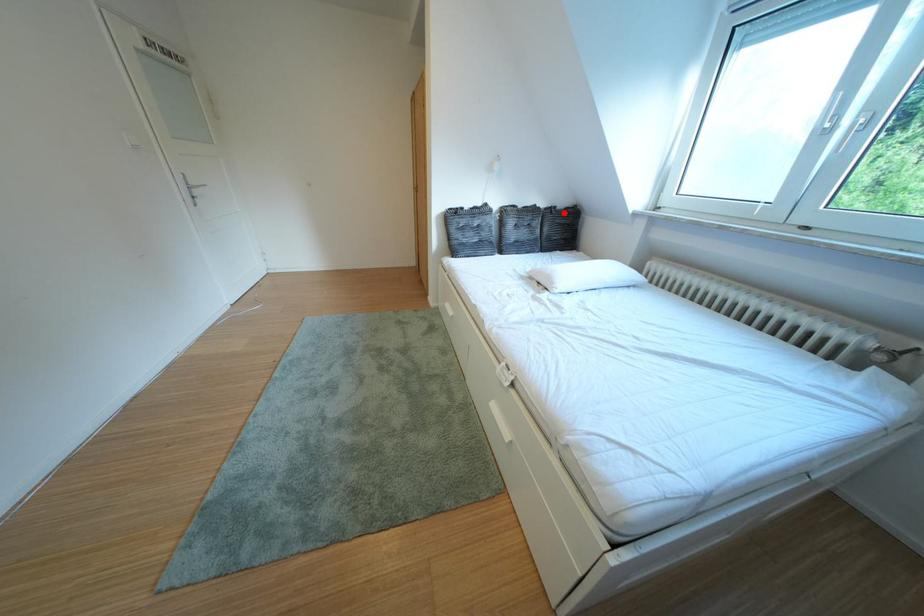
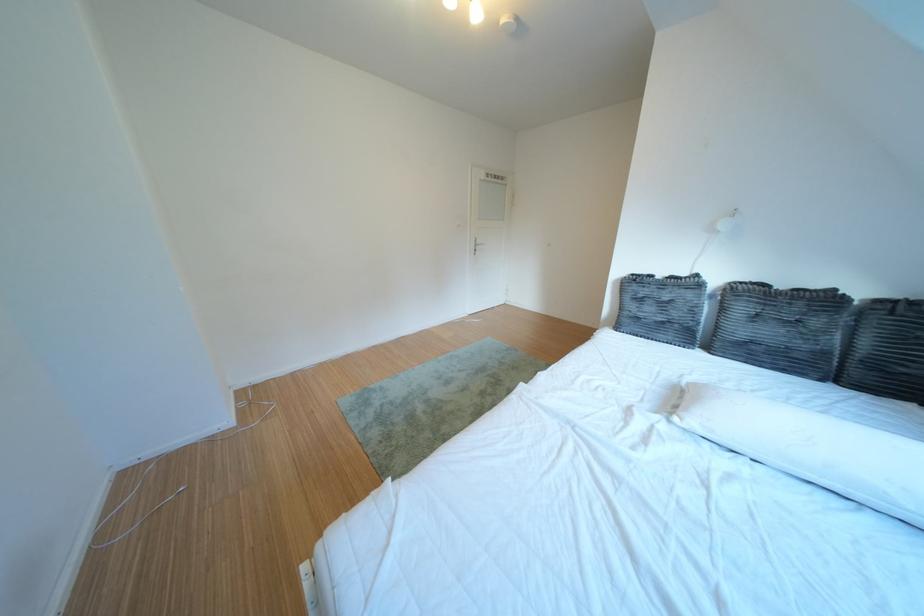
Question: I am providing you with two images of the same scene from different viewpoints. Given a red point in image1, look at the same physical point in image2. Is it:

Choices:
 (A) Closer to the viewpoint
 (B) Farther from the viewpoint

Answer: (B)